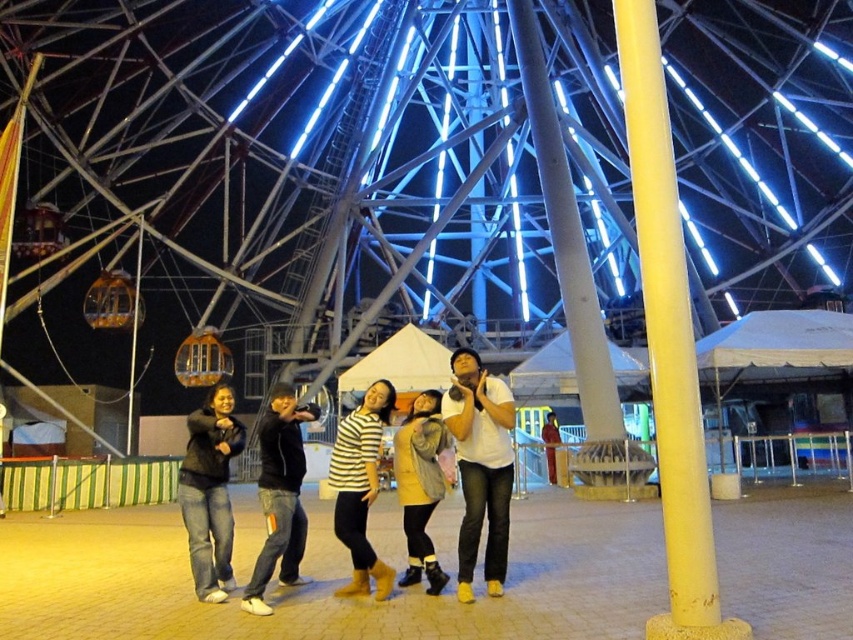
You are a photographer standing at the base of the Ferris wheel and want to take a photo that includes both the yellow matte pole at right and the striped shirt at center. Which object should you position closer to the front of the frame to ensure both are fully visible?

To ensure both the yellow matte pole at right and the striped shirt at center are fully visible, position the striped shirt at center closer to the front of the frame since it is shorter than the yellow matte pole at right.

You are standing in front of the Ferris wheel at the amusement park and see both the black denim jeans at center and the yellow fuzzy coat at center. Which one is nearer to you?

The black denim jeans at center is closer to the viewer than the yellow fuzzy coat at center, so the black denim jeans at center is nearer to you.

You are a photographer setting up a tripod for a night shot. You have a tripod that requires a base width of at least 30 cm to remain stable. You see the yellow matte pole at right and the striped shirt at center in the scene. Which object should you use as a reference to determine if the tripod will fit stably between them?

The yellow matte pole at right might be wider than striped shirt at center, so you should check the width of the yellow matte pole at right to ensure the tripod has enough space.